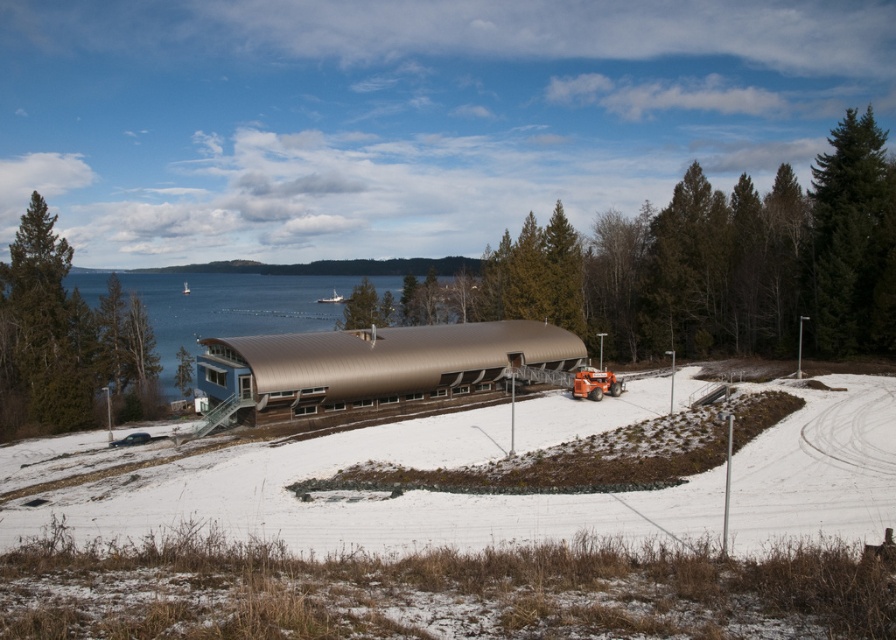
Is green textured pine tree at right positioned in front of green matte tree at upper center?

Yes, it is in front of green matte tree at upper center.

Between green textured pine tree at right and green matte tree at upper center, which one is positioned higher?

green textured pine tree at right is above.

Is point (856, 186) closer to camera compared to point (358, 291)?

Yes, it is in front of point (358, 291).

Identify the location of green textured pine tree at right. The image size is (896, 640). (853, 240).

Is point (24, 360) behind point (363, 296)?

No, (24, 360) is in front of (363, 296).

Is green textured tree at left closer to the viewer compared to green matte tree at upper center?

Yes, green textured tree at left is closer to the viewer.

The image size is (896, 640). I want to click on green textured tree at left, so click(x=65, y=339).

Identify the location of green textured tree at left. (65, 339).

Can you confirm if green textured tree at left is shorter than metallic water at center?

Indeed, green textured tree at left has a lesser height compared to metallic water at center.

Is green textured tree at left wider than metallic water at center?

No, green textured tree at left is not wider than metallic water at center.

Does point (22, 228) come closer to viewer compared to point (82, 289)?

Yes, point (22, 228) is in front of point (82, 289).

Locate an element on the screen. green textured tree at left is located at coordinates (65, 339).